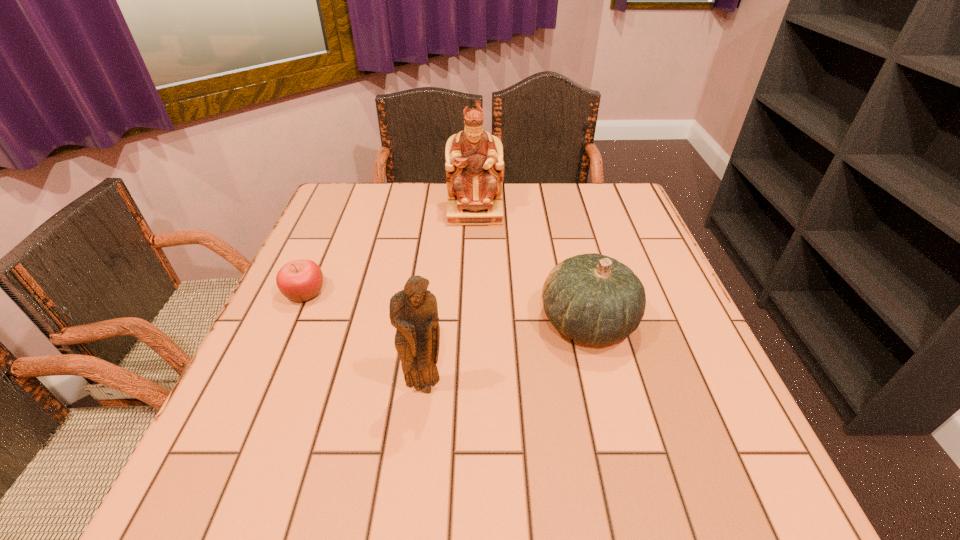
Image resolution: width=960 pixels, height=540 pixels. What are the coordinates of `vacant area that lies between the gourd and the nearest object` in the screenshot? It's located at (506, 354).

I want to click on vacant point located between the farthest object and the second shortest object, so (532, 267).

The height and width of the screenshot is (540, 960). I want to click on unoccupied area between the rightmost object and the leftmost object, so click(446, 308).

I want to click on blank region between the farthest object and the shortest object, so click(390, 253).

The height and width of the screenshot is (540, 960). I want to click on vacant space that's between the shortest object and the farther figurine, so click(x=390, y=253).

The width and height of the screenshot is (960, 540). I want to click on free space between the nearest object and the leftmost object, so click(365, 340).

Where is `unoccupied area between the nearer figurine and the rightmost object`? This screenshot has height=540, width=960. unoccupied area between the nearer figurine and the rightmost object is located at coordinates (506, 354).

You are a GUI agent. You are given a task and a screenshot of the screen. Output one action in this format:
    pyautogui.click(x=<x>, y=<y>)
    Task: Click on the free point between the nearer figurine and the rightmost object
    This screenshot has width=960, height=540.
    Given the screenshot: What is the action you would take?
    pyautogui.click(x=506, y=354)

Locate which object is the third closest to the gourd. Please provide its 2D coordinates. Your answer should be formatted as a tuple, i.e. [(x, y)], where the tuple contains the x and y coordinates of a point satisfying the conditions above.

[(299, 280)]

In order to click on object identified as the third closest to the shortest object in this screenshot , I will do `click(591, 298)`.